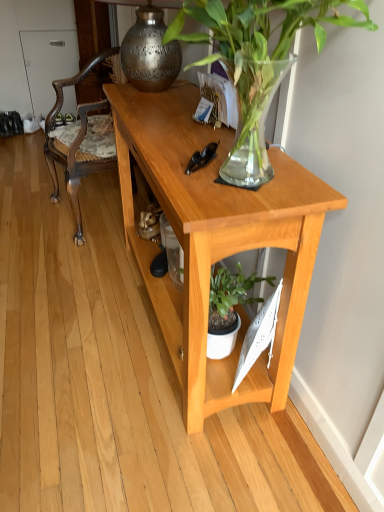
You are a GUI agent. You are given a task and a screenshot of the screen. Output one action in this format:
    pyautogui.click(x=<x>, y=<y>)
    Task: Click on the free area behind black plastic sunglasses at center
    This screenshot has height=512, width=384.
    Given the screenshot: What is the action you would take?
    pyautogui.click(x=189, y=143)